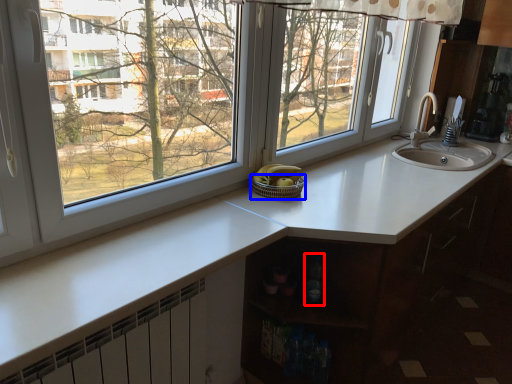
Question: Which object is further to the camera taking this photo, bottle (highlighted by a red box) or basket (highlighted by a blue box)?

Choices:
 (A) bottle
 (B) basket

Answer: (B)